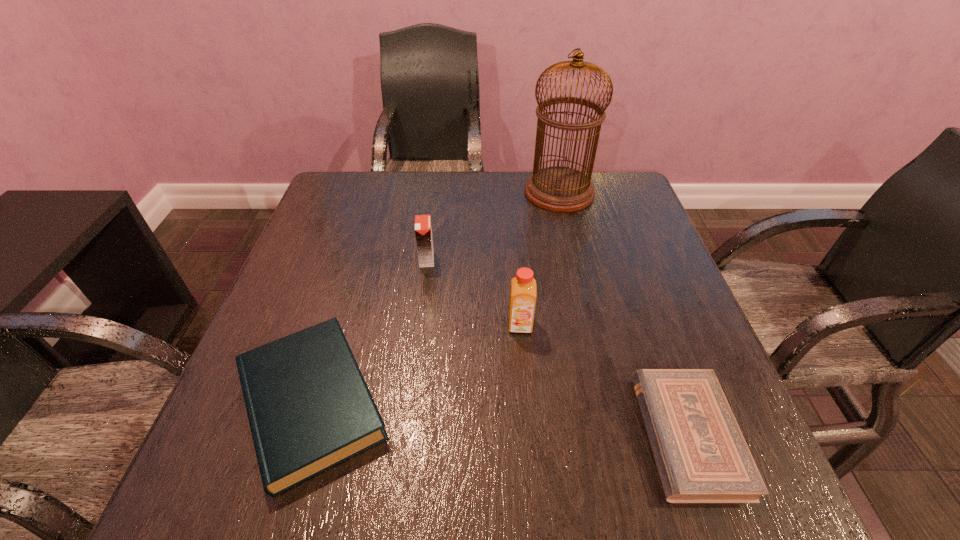
Identify the location of free space between the farther orange juice and the book. Image resolution: width=960 pixels, height=540 pixels. (369, 331).

Find the location of a particular element. vacant area that lies between the third object from right to left and the shortest object is located at coordinates (604, 380).

In order to click on vacant area that lies between the right orange juice and the Bible in this screenshot , I will do `click(604, 380)`.

Identify which object is the third closest to the farthest object. Please provide its 2D coordinates. Your answer should be formatted as a tuple, i.e. [(x, y)], where the tuple contains the x and y coordinates of a point satisfying the conditions above.

[(309, 408)]

Where is `the fourth closest object to the Bible`? This screenshot has height=540, width=960. the fourth closest object to the Bible is located at coordinates (562, 189).

Locate an element on the screen. Image resolution: width=960 pixels, height=540 pixels. vacant area in the image that satisfies the following two spatial constraints: 1. on the front-facing side of the tallest object; 2. on the front and back of the nearer orange juice is located at coordinates (590, 325).

Find the location of a particular element. free space in the image that satisfies the following two spatial constraints: 1. on the front-facing side of the farthest object; 2. on the front and back of the fourth shortest object is located at coordinates (590, 325).

This screenshot has width=960, height=540. I want to click on vacant space that satisfies the following two spatial constraints: 1. on the front-facing side of the birdcage; 2. on the front and back of the right orange juice, so click(590, 325).

You are a GUI agent. You are given a task and a screenshot of the screen. Output one action in this format:
    pyautogui.click(x=<x>, y=<y>)
    Task: Click on the vacant space that satisfies the following two spatial constraints: 1. on the back side of the third tallest object; 2. on the left side of the leftmost object
    Image resolution: width=960 pixels, height=540 pixels.
    Given the screenshot: What is the action you would take?
    pyautogui.click(x=355, y=259)

The height and width of the screenshot is (540, 960). I want to click on free region that satisfies the following two spatial constraints: 1. on the front-facing side of the farthest object; 2. on the front side of the left orange juice, so click(575, 259).